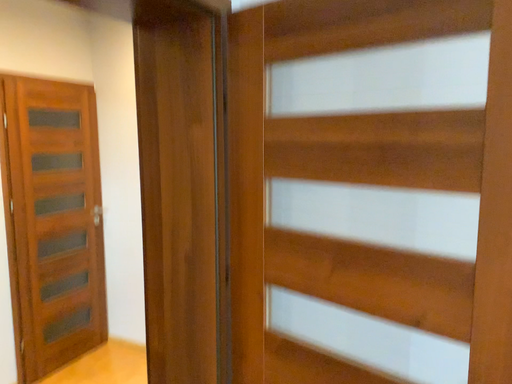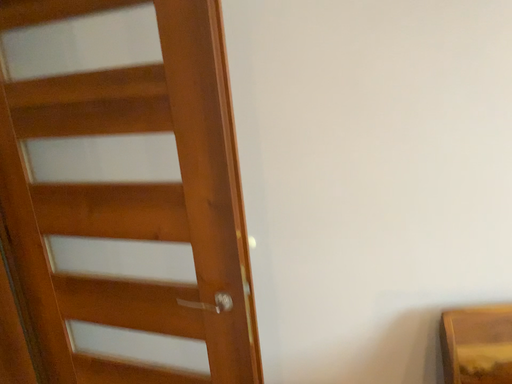
Question: How did the camera likely rotate when shooting the video?

Choices:
 (A) rotated right
 (B) rotated left

Answer: (A)